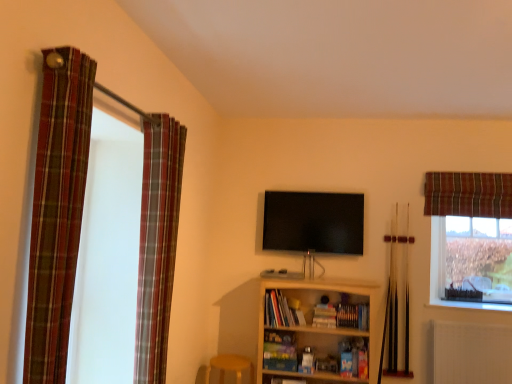
Question: Does white textured radiator at lower right have a greater height compared to flat screen tv at center?

Choices:
 (A) yes
 (B) no

Answer: (B)

Question: Is white textured radiator at lower right positioned in front of flat screen tv at center?

Choices:
 (A) no
 (B) yes

Answer: (B)

Question: Is white textured radiator at lower right outside of flat screen tv at center?

Choices:
 (A) yes
 (B) no

Answer: (A)

Question: Could flat screen tv at center be considered to be inside white textured radiator at lower right?

Choices:
 (A) yes
 (B) no

Answer: (B)

Question: Is white textured radiator at lower right smaller than flat screen tv at center?

Choices:
 (A) no
 (B) yes

Answer: (B)

Question: Is white textured radiator at lower right thinner than flat screen tv at center?

Choices:
 (A) yes
 (B) no

Answer: (B)

Question: Considering the relative sizes of flat screen tv at center and plaid fabric curtain at left, acting as the 1th curtain starting from the left, in the image provided, is flat screen tv at center shorter than plaid fabric curtain at left, acting as the 1th curtain starting from the left,?

Choices:
 (A) yes
 (B) no

Answer: (A)

Question: Does flat screen tv at center have a lesser width compared to plaid fabric curtain at left, which is the 3th curtain in back-to-front order?

Choices:
 (A) no
 (B) yes

Answer: (B)

Question: Is flat screen tv at center oriented away from plaid fabric curtain at left, which is the 1th curtain from front to back?

Choices:
 (A) no
 (B) yes

Answer: (A)

Question: Considering the relative positions of flat screen tv at center and plaid fabric curtain at left, which is the 1th curtain from front to back, in the image provided, is flat screen tv at center to the left of plaid fabric curtain at left, which is the 1th curtain from front to back, from the viewer's perspective?

Choices:
 (A) no
 (B) yes

Answer: (A)

Question: Is flat screen tv at center facing towards plaid fabric curtain at left, acting as the 3th curtain starting from the right?

Choices:
 (A) yes
 (B) no

Answer: (A)

Question: Is flat screen tv at center not close to plaid fabric curtain at left, which is the 1th curtain from front to back?

Choices:
 (A) no
 (B) yes

Answer: (B)

Question: Is the depth of clear glass window at upper right less than that of flat screen tv at center?

Choices:
 (A) yes
 (B) no

Answer: (B)